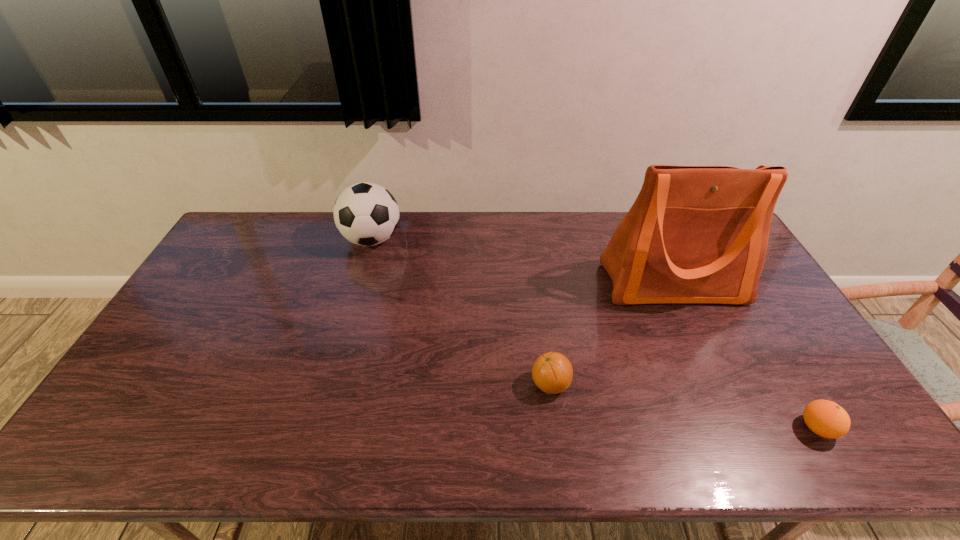
The image size is (960, 540). Find the location of `the tallest object`. the tallest object is located at coordinates (695, 234).

Identify the location of the third shortest object. (367, 214).

At what (x,y) coordinates should I click in order to perform the action: click on soccer ball. Please return your answer as a coordinate pair (x, y). The image size is (960, 540). Looking at the image, I should click on coord(367,214).

The height and width of the screenshot is (540, 960). Find the location of `the farther orange`. the farther orange is located at coordinates (552, 372).

Identify the location of the taller orange. (552, 372).

Identify the location of the nearest object. (825, 418).

Locate an element on the screen. The width and height of the screenshot is (960, 540). the shorter orange is located at coordinates (825, 418).

At what (x,y) coordinates should I click in order to perform the action: click on free space located on the back of the shopping bag. Please return your answer as a coordinate pair (x, y). Looking at the image, I should click on (654, 242).

Where is `vacant point located 0.380m on the right of the soccer ball`? vacant point located 0.380m on the right of the soccer ball is located at coordinates (506, 239).

The width and height of the screenshot is (960, 540). What are the coordinates of `free spot located 0.210m on the back of the left orange` in the screenshot? It's located at (540, 311).